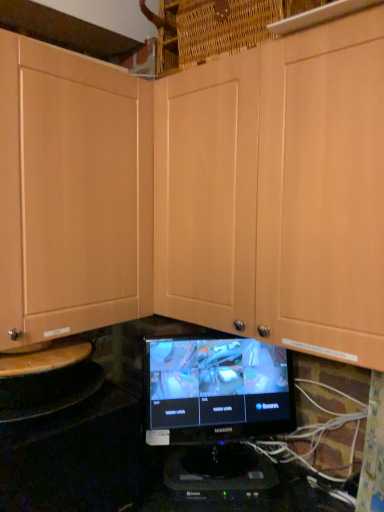
Question: From the image's perspective, is black plastic monitor at center located above or below matte wood cabinet at center?

Choices:
 (A) above
 (B) below

Answer: (B)

Question: Would you say black plastic monitor at center is to the left or to the right of matte wood cabinet at center in the picture?

Choices:
 (A) right
 (B) left

Answer: (B)

Question: Estimate the real-world distances between objects in this image. Which object is closer to the black plastic monitor at center?

Choices:
 (A) black glossy monitor at center
 (B) matte wood cabinet at center

Answer: (A)

Question: Which object is positioned closest to the black glossy monitor at center?

Choices:
 (A) matte wood cabinet at center
 (B) black plastic monitor at center

Answer: (B)